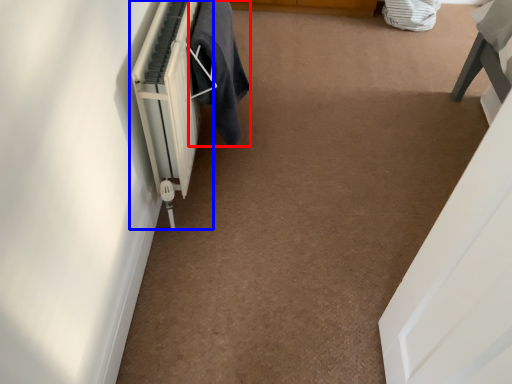
Question: Which object is further to the camera taking this photo, laundry (highlighted by a red box) or radiator (highlighted by a blue box)?

Choices:
 (A) laundry
 (B) radiator

Answer: (A)